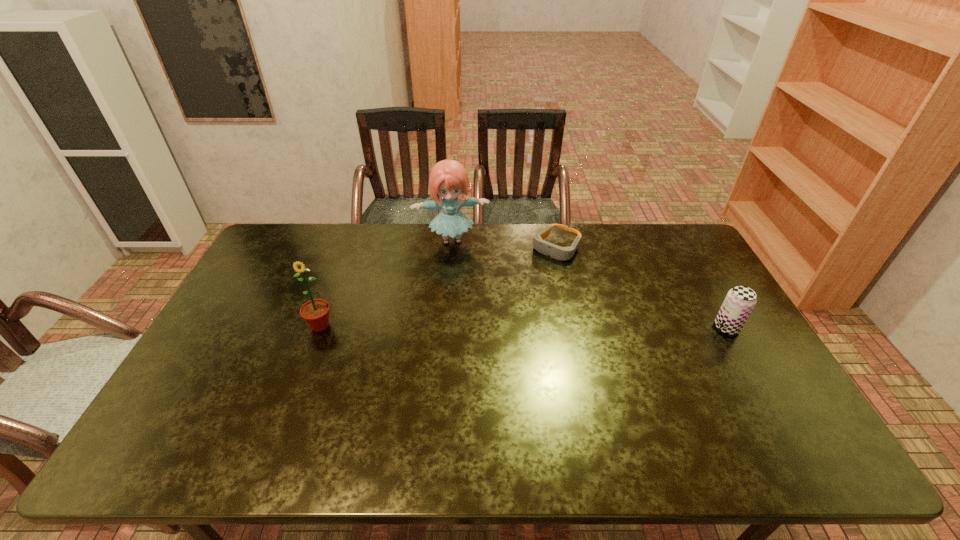
The height and width of the screenshot is (540, 960). In the image, there is a desktop. In order to click on free space at the near edge in this screenshot , I will do `click(418, 402)`.

The height and width of the screenshot is (540, 960). In order to click on vacant region at the left edge of the desktop in this screenshot , I will do `click(247, 280)`.

I want to click on free space at the right edge of the desktop, so click(x=707, y=277).

This screenshot has height=540, width=960. In the image, there is a desktop. Identify the location of vacant region at the far right corner. (683, 235).

The height and width of the screenshot is (540, 960). In the image, there is a desktop. In order to click on free space at the near right corner in this screenshot , I will do 759,407.

The image size is (960, 540). In order to click on free space between the third shortest object and the doll in this screenshot , I will do `click(386, 283)`.

Find the location of `free point between the sunflower and the tallest object`. free point between the sunflower and the tallest object is located at coordinates (386, 283).

I want to click on free space between the second shortest object and the leftmost object, so click(x=523, y=327).

Where is `vacant space that is in between the doll and the second tallest object`? The width and height of the screenshot is (960, 540). vacant space that is in between the doll and the second tallest object is located at coordinates (386, 283).

Locate an element on the screen. This screenshot has width=960, height=540. empty space that is in between the tallest object and the beer can is located at coordinates (589, 284).